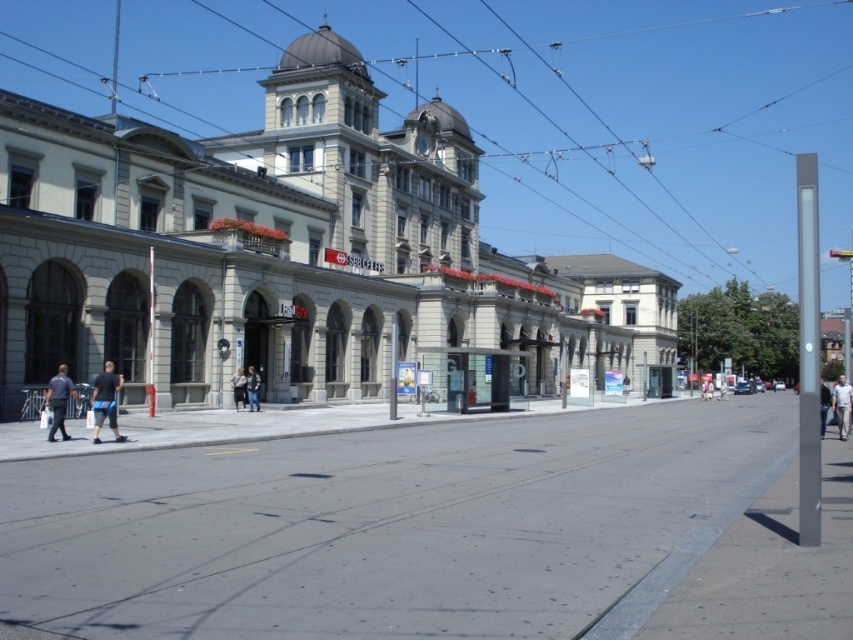
Question: Which point is farther from the camera taking this photo?

Choices:
 (A) (846, 422)
 (B) (231, 65)

Answer: (B)

Question: From the image, what is the correct spatial relationship of metallic wire at upper center in relation to dark blue jeans at lower left?

Choices:
 (A) above
 (B) below

Answer: (A)

Question: Can you confirm if gray concrete pavement at lower center is bigger than dark blue jeans at center?

Choices:
 (A) yes
 (B) no

Answer: (A)

Question: Can you confirm if light brown leather jacket at center is bigger than light blue jeans at center?

Choices:
 (A) yes
 (B) no

Answer: (B)

Question: Which object appears closest to the camera in this image?

Choices:
 (A) light brown leather jacket at center
 (B) denim jacket at center
 (C) metallic wire at upper center

Answer: (B)

Question: Which is nearer to the gray concrete pavement at lower center?

Choices:
 (A) light brown leather jacket at center
 (B) dark blue jeans at left
 (C) metallic wire at upper center

Answer: (B)